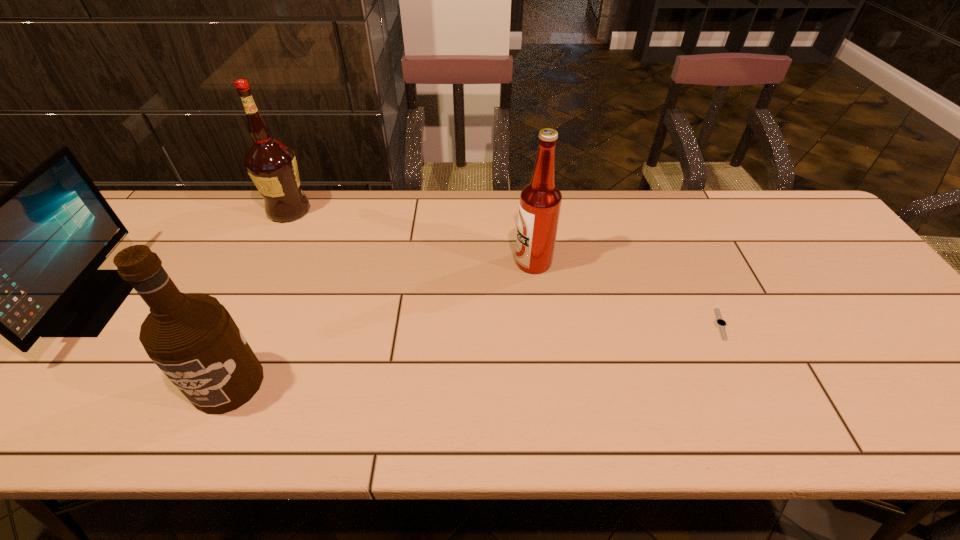
The image size is (960, 540). Identify the location of free space located 0.250m on the label side of the second nearest alcohol. (425, 262).

Identify the location of free space located on the label side of the second nearest alcohol. (479, 262).

You are a GUI agent. You are given a task and a screenshot of the screen. Output one action in this format:
    pyautogui.click(x=<x>, y=<y>)
    Task: Click on the vacant area located 0.060m on the screen side of the monitor
    The width and height of the screenshot is (960, 540).
    Given the screenshot: What is the action you would take?
    pyautogui.click(x=147, y=302)

What are the coordinates of `vacant space located on the right of the watch` in the screenshot? It's located at (800, 324).

At what (x,y) coordinates should I click in order to perform the action: click on object that is at the far edge. Please return your answer as a coordinate pair (x, y). The width and height of the screenshot is (960, 540). Looking at the image, I should click on (272, 166).

Locate an element on the screen. Image resolution: width=960 pixels, height=540 pixels. object at the near edge is located at coordinates (192, 338).

Locate an element on the screen. object at the left edge is located at coordinates (24, 264).

Locate an element on the screen. This screenshot has width=960, height=540. vacant space at the far edge of the desktop is located at coordinates (389, 232).

This screenshot has height=540, width=960. What are the coordinates of `vacant space at the near edge of the desktop` in the screenshot? It's located at (495, 437).

The image size is (960, 540). I want to click on vacant space at the left edge of the desktop, so click(x=46, y=355).